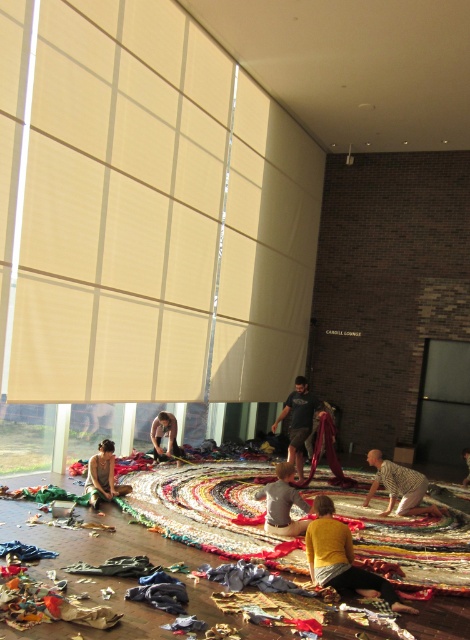
Question: Which of the following is the closest to the observer?

Choices:
 (A) yellow cotton shirt at center
 (B) striped fabric at center
 (C) matte black fabric at center
 (D) yellow textured shirt at lower right

Answer: (A)

Question: Which of the following is the closest to the observer?

Choices:
 (A) striped fabric at center
 (B) yellow cotton shirt at center
 (C) yellow textured shirt at lower right

Answer: (B)

Question: Which point is farther from the camera taking this photo?

Choices:
 (A) (112, 484)
 (B) (297, 436)

Answer: (B)

Question: From the image, what is the correct spatial relationship of yellow cotton shirt at center in relation to matte black fabric at center?

Choices:
 (A) left
 (B) right

Answer: (B)

Question: From the image, what is the correct spatial relationship of multicolored fabric rug at lower left in relation to dark gray t-shirt at center?

Choices:
 (A) left
 (B) right

Answer: (A)

Question: Does multicolored fabric rug at lower left lie behind yellow cotton shirt at center?

Choices:
 (A) no
 (B) yes

Answer: (B)